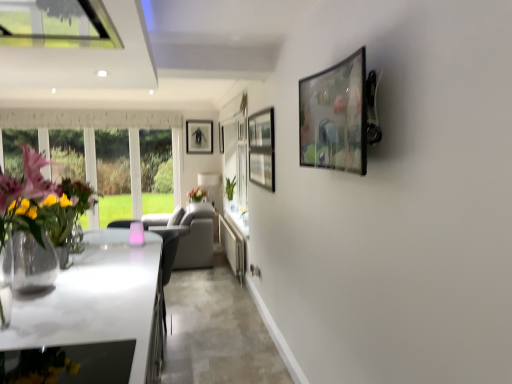
Question: Is translucent glass vase at center taller or shorter than matte black picture frame at center, the first picture frame from the left?

Choices:
 (A) short
 (B) tall

Answer: (A)

Question: Considering the relative positions of translucent glass vase at center and matte black picture frame at center, the first picture frame from the left, in the image provided, is translucent glass vase at center to the left or to the right of matte black picture frame at center, the first picture frame from the left,?

Choices:
 (A) left
 (B) right

Answer: (B)

Question: Which is nearer to the white glossy countertop at lower left?

Choices:
 (A) white glossy counter top at center
 (B) translucent glass vase at center
 (C) metallic glossy picture frame at upper right, arranged as the 1th picture frame when viewed from the right
 (D) black matte picture frame at center, marked as the second picture frame in a left-to-right arrangement
 (E) white fabric lampshade at center

Answer: (C)

Question: Which object is the closest to the white glossy countertop at lower left?

Choices:
 (A) translucent glass vase at center
 (B) clear glass vase at left
 (C) matte black picture frame at center, placed as the 3th picture frame when sorted from right to left
 (D) metallic glossy picture frame at upper right, the first picture frame positioned from the front
 (E) white fabric lampshade at center

Answer: (B)